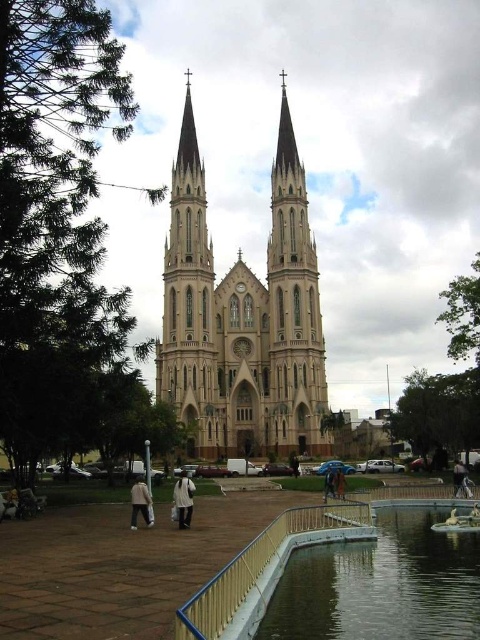
Question: Which object is positioned farthest from the brown leather jacket at center?

Choices:
 (A) light beige coat at lower left
 (B) clear glass water at lower right
 (C) beige stone church at center

Answer: (C)

Question: Can you confirm if light beige coat at lower left is thinner than brown leather jacket at center?

Choices:
 (A) no
 (B) yes

Answer: (A)

Question: Estimate the real-world distances between objects in this image. Which object is closer to the smooth beige tower at center?

Choices:
 (A) beige stone church at center
 (B) clear glass water at lower right

Answer: (A)

Question: Can you confirm if light brown leather jacket at lower right is positioned above blue fabric umbrella at center?

Choices:
 (A) yes
 (B) no

Answer: (B)

Question: Is clear glass water at lower right positioned behind smooth beige tower at center?

Choices:
 (A) no
 (B) yes

Answer: (A)

Question: Considering the real-world distances, which object is farthest from the blue fabric umbrella at center?

Choices:
 (A) beige stone church at center
 (B) light beige coat at lower left
 (C) brown leather jacket at center

Answer: (A)